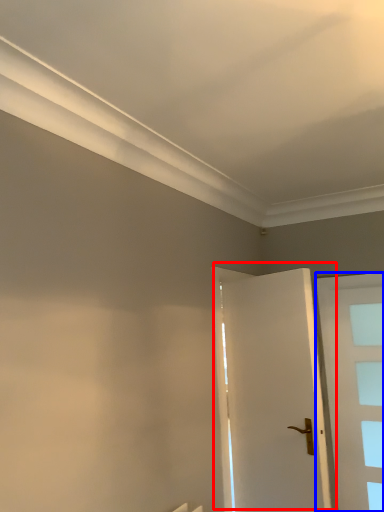
Question: Which point is closer to the camera, door (highlighted by a red box) or door (highlighted by a blue box)?

Choices:
 (A) door
 (B) door

Answer: (A)